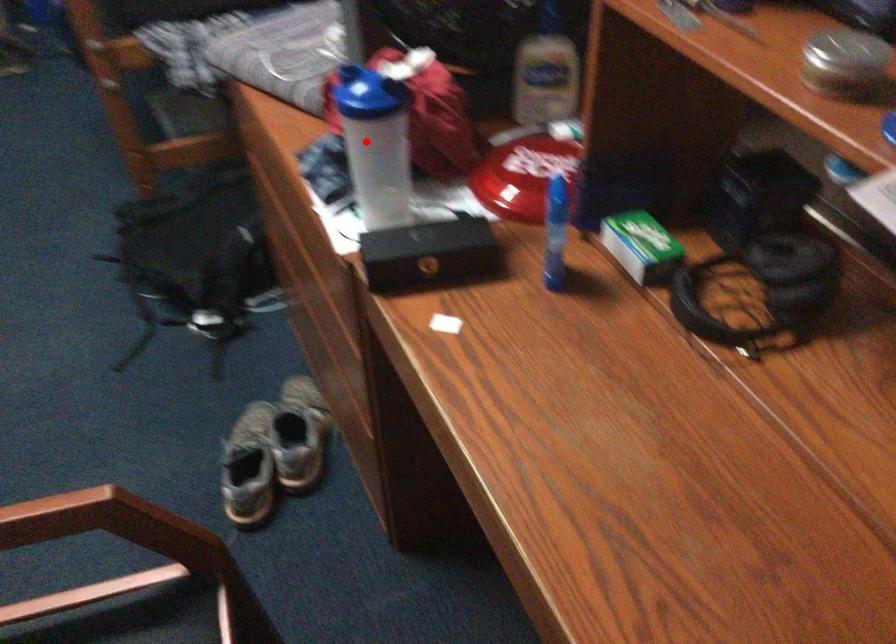
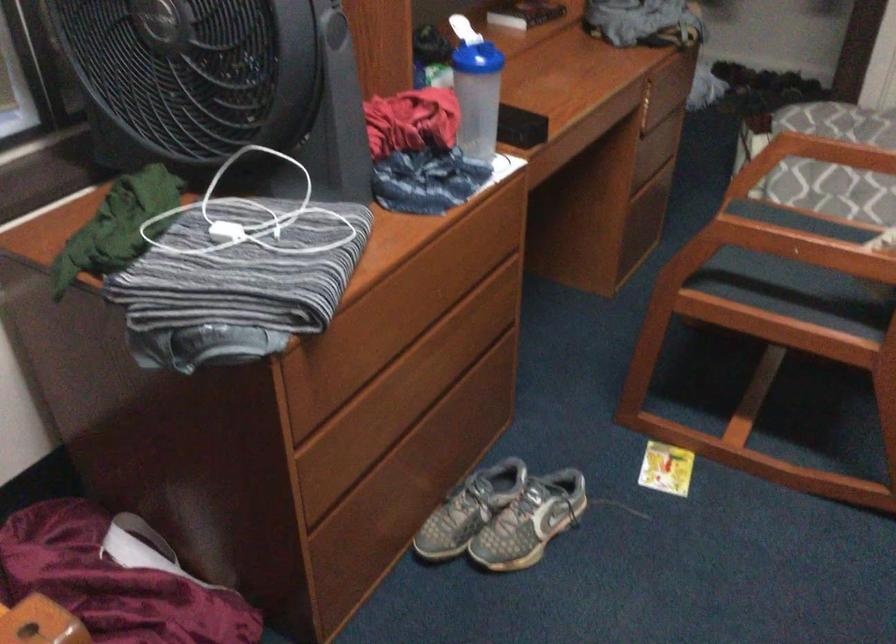
Question: A red point is marked in image1. In image2, is the corresponding 3D point closer to the camera or farther? Reply with the corresponding letter.

Choices:
 (A) The corresponding 3D point is closer.
 (B) The corresponding 3D point is farther.

Answer: (B)